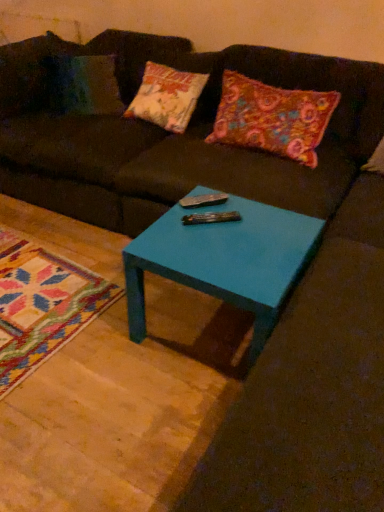
Where is `vacant region in front of metallic silver remote at center`? Image resolution: width=384 pixels, height=512 pixels. vacant region in front of metallic silver remote at center is located at coordinates (205, 246).